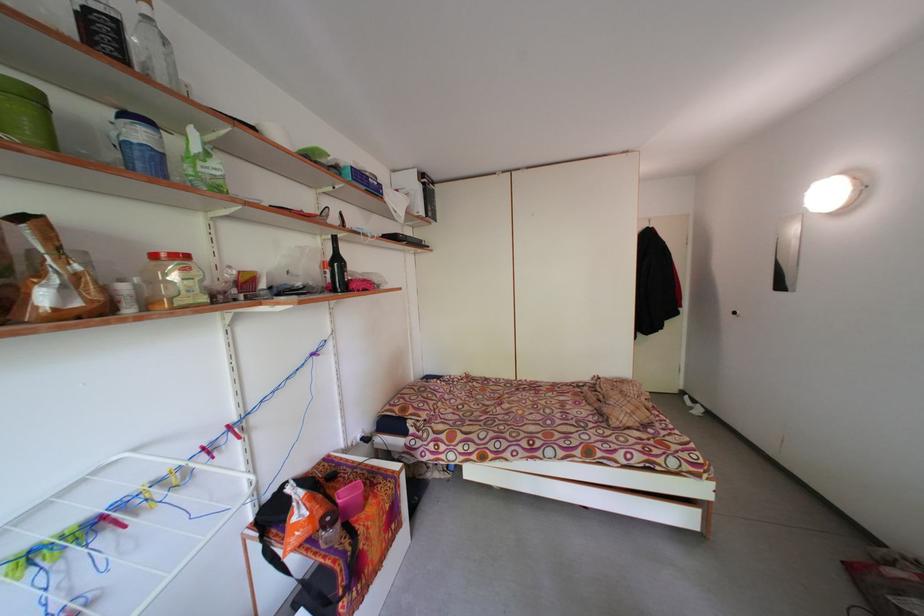
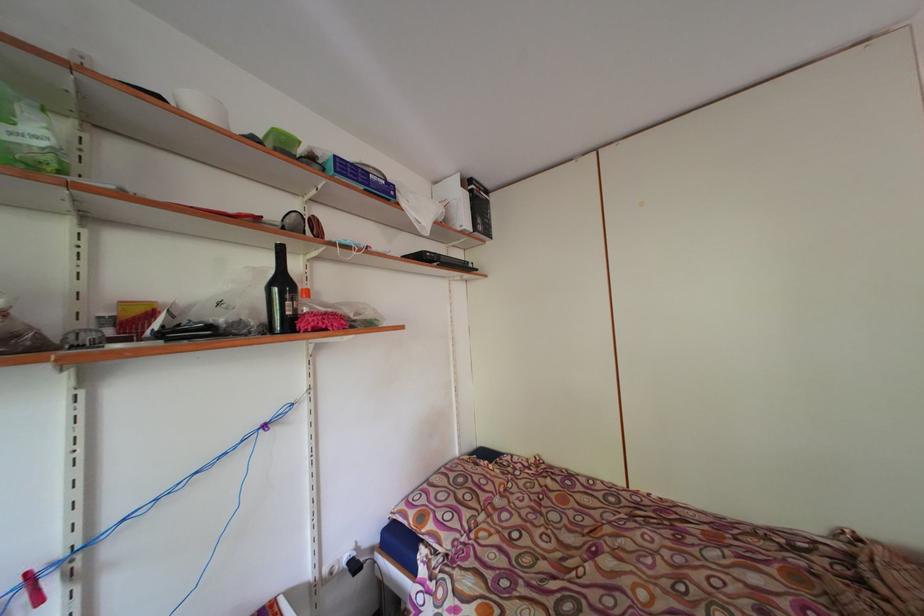
The point at [237,432] is marked in the first image. Where is the corresponding point in the second image?

(35, 580)